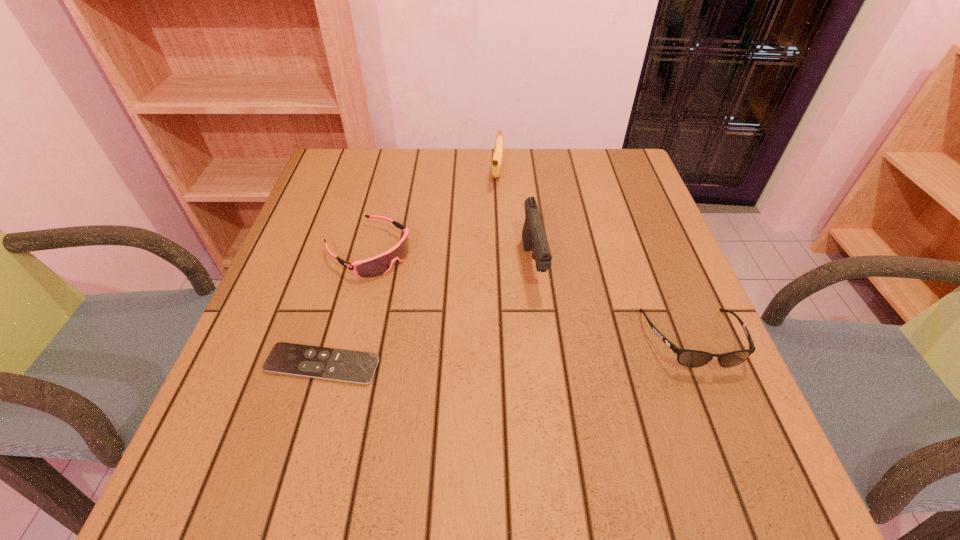
The height and width of the screenshot is (540, 960). In order to click on free spot between the farthest object and the remote control in this screenshot , I will do tap(410, 268).

Locate an element on the screen. The height and width of the screenshot is (540, 960). free space between the rightmost object and the goggles is located at coordinates (530, 295).

Where is `empty space between the goggles and the third object from left to right`? This screenshot has height=540, width=960. empty space between the goggles and the third object from left to right is located at coordinates (433, 211).

This screenshot has width=960, height=540. I want to click on free spot between the second object from right to left and the goggles, so click(450, 258).

The width and height of the screenshot is (960, 540). In order to click on unoccupied position between the shortest object and the farthest object in this screenshot , I will do `click(410, 268)`.

The height and width of the screenshot is (540, 960). What are the coordinates of `free space that is in between the remote control and the pistol` in the screenshot? It's located at pos(427,315).

Locate an element on the screen. vacant point located between the sunglasses and the remote control is located at coordinates (507, 352).

Identify the location of unoccupied position between the goggles and the banana. Image resolution: width=960 pixels, height=540 pixels. (433, 211).

At what (x,y) coordinates should I click in order to perform the action: click on vacant area that lies between the goggles and the third object from right to left. Please return your answer as a coordinate pair (x, y). This screenshot has height=540, width=960. Looking at the image, I should click on (433, 211).

This screenshot has width=960, height=540. I want to click on the closest object to the farthest object, so click(x=534, y=239).